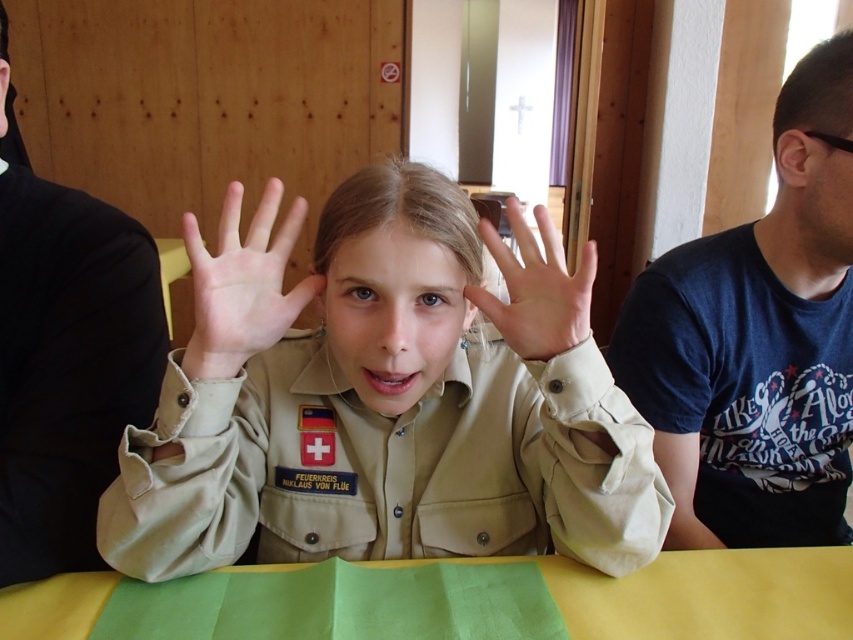
Question: Which of the following is the farthest from the observer?

Choices:
 (A) (292, 320)
 (B) (15, 216)

Answer: (B)

Question: Considering the real-world distances, which object is closest to the dark blue t-shirt at right?

Choices:
 (A) tan uniform at center
 (B) smooth beige hand at center
 (C) black fabric shirt at left
 (D) green fabric at center

Answer: (D)

Question: Which point is farther from the camera taking this photo?

Choices:
 (A) (12, 216)
 (B) (640, 600)
 (C) (726, 275)

Answer: (C)

Question: Where is dark blue t-shirt at right located in relation to matte beige hand at center in the image?

Choices:
 (A) right
 (B) left

Answer: (A)

Question: Can you confirm if tan uniform at center is bigger than matte beige hand at center?

Choices:
 (A) no
 (B) yes

Answer: (B)

Question: Is green fabric at center further to the viewer compared to smooth beige hand at center?

Choices:
 (A) yes
 (B) no

Answer: (A)